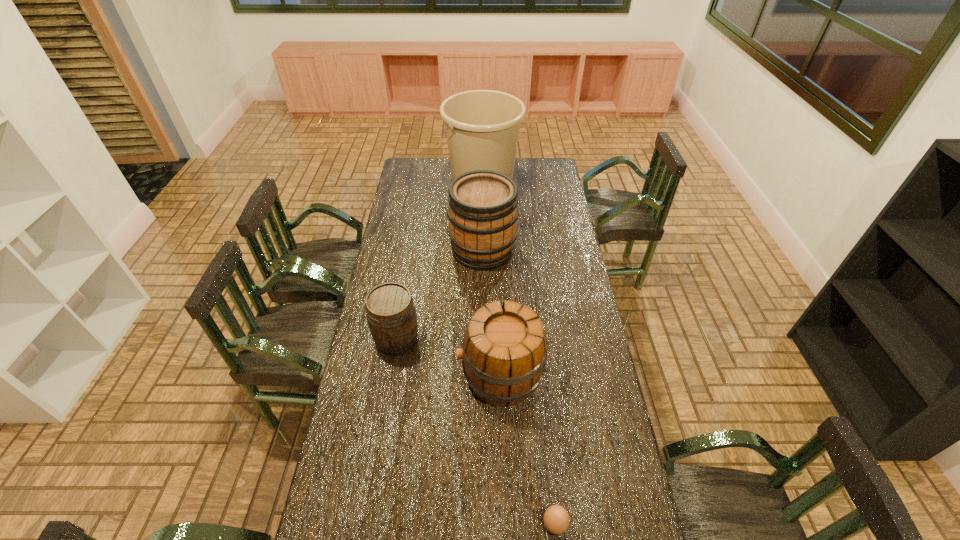
Locate an element on the screen. Image resolution: width=960 pixels, height=540 pixels. free space located 0.330m on the side of the leftmost cider near the bung hole is located at coordinates (379, 446).

Where is `vacant space located 0.360m on the back of the nearest object`? The width and height of the screenshot is (960, 540). vacant space located 0.360m on the back of the nearest object is located at coordinates [x=541, y=400].

This screenshot has height=540, width=960. I want to click on object positioned at the far edge, so click(x=482, y=127).

Image resolution: width=960 pixels, height=540 pixels. I want to click on object at the left edge, so click(x=391, y=315).

In the image, there is a desktop. At what (x,y) coordinates should I click in order to perform the action: click on vacant space at the far edge. Please return your answer as a coordinate pair (x, y). The height and width of the screenshot is (540, 960). Looking at the image, I should click on (523, 173).

Image resolution: width=960 pixels, height=540 pixels. Find the location of `vacant space at the left edge of the desktop`. vacant space at the left edge of the desktop is located at coordinates (378, 420).

I want to click on vacant space at the right edge of the desktop, so 548,218.

Where is `vacant space at the far left corner of the desktop`? vacant space at the far left corner of the desktop is located at coordinates (428, 168).

The height and width of the screenshot is (540, 960). In order to click on empty space between the second tallest object and the leftmost object in this screenshot , I will do `click(440, 295)`.

Where is `the second closest object to the leftmost cider`? Image resolution: width=960 pixels, height=540 pixels. the second closest object to the leftmost cider is located at coordinates (483, 210).